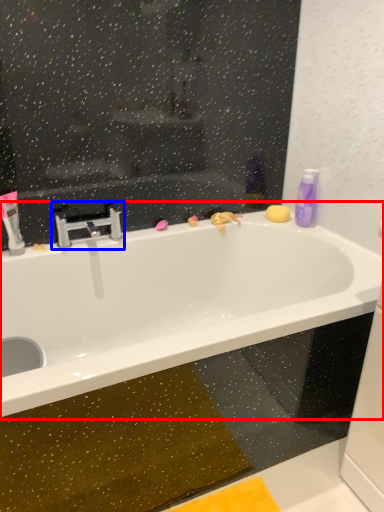
Question: Among these objects, which one is farthest to the camera, bathtub (highlighted by a red box) or tap (highlighted by a blue box)?

Choices:
 (A) bathtub
 (B) tap

Answer: (B)